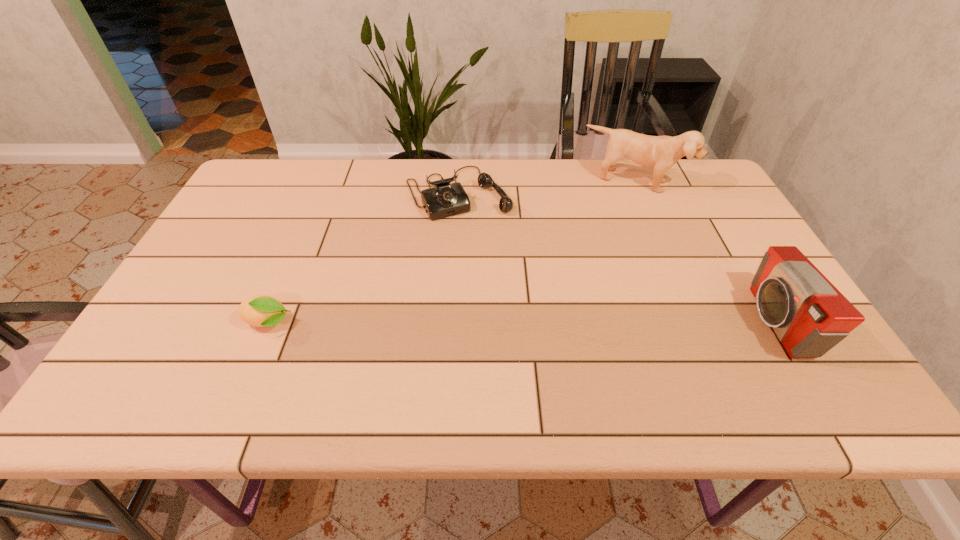
Identify the location of camera at the right edge. (809, 315).

Locate an element on the screen. This screenshot has height=540, width=960. puppy that is at the right edge is located at coordinates (659, 152).

This screenshot has width=960, height=540. What are the coordinates of `object that is at the far right corner` in the screenshot? It's located at (659, 152).

The height and width of the screenshot is (540, 960). Identify the location of object at the near right corner. (809, 315).

At what (x,y) coordinates should I click in order to perform the action: click on vacant space at the far edge of the desktop. Please return your answer as a coordinate pair (x, y). The image size is (960, 540). Looking at the image, I should click on (459, 161).

In order to click on vacant space at the near edge of the desktop in this screenshot , I will do `click(407, 354)`.

Find the location of `free space at the left edge`. free space at the left edge is located at coordinates (214, 230).

This screenshot has height=540, width=960. In order to click on free space at the right edge in this screenshot , I will do `click(715, 267)`.

Find the location of a particular element. This screenshot has width=960, height=540. vacant space at the near right corner of the desktop is located at coordinates (812, 360).

Identify the location of vacant region between the tallest object and the second shortest object. (547, 187).